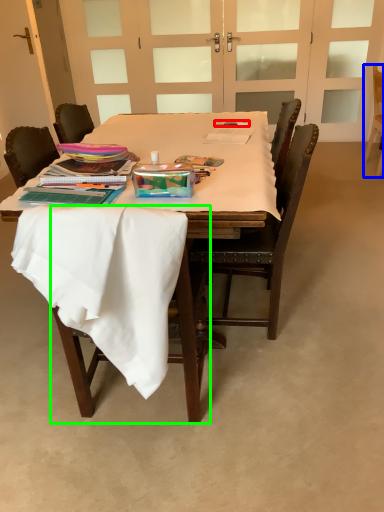
Question: Which is nearer to the pen (highlighted by a red box)? chair (highlighted by a blue box) or chair (highlighted by a green box).

Choices:
 (A) chair
 (B) chair

Answer: (B)